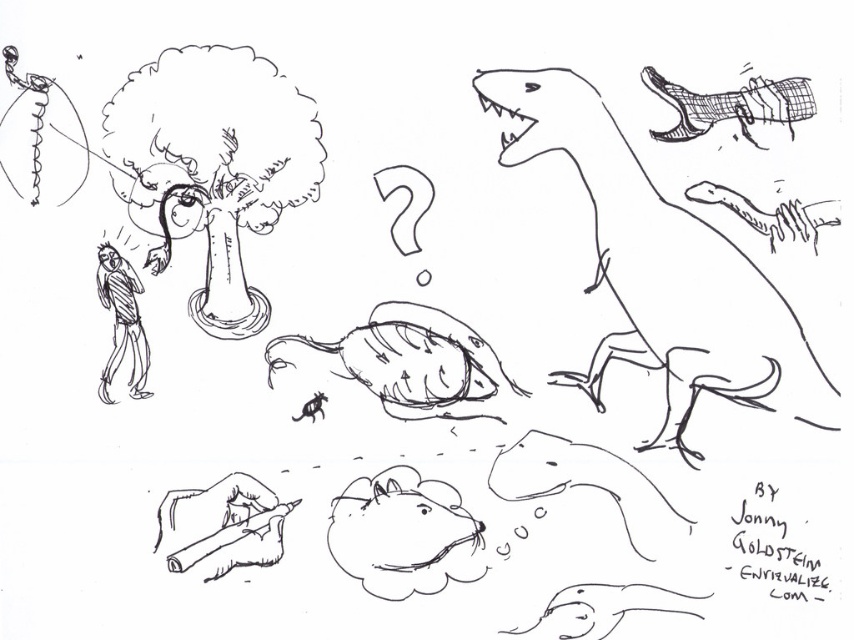
You are a cat trying to catch the smooth brown mouse at center and the fluffy white mouse at lower center. Which mouse should you chase first if you want to catch the one that is closer to you?

The smooth brown mouse at center is closer to you than the fluffy white mouse at lower center, so you should chase the smooth brown mouse at center first.

Based on the coordinates provided in the scene description, where exactly is the smooth gray dinosaur at lower center located?

The smooth gray dinosaur at lower center is located at point [588,484].

In the black and white sketch, there are two mice. The smooth brown mouse at center and the fluffy white mouse at lower center. Which mouse is located to the left of the other?

The smooth brown mouse at center is positioned on the left side of fluffy white mouse at lower center.